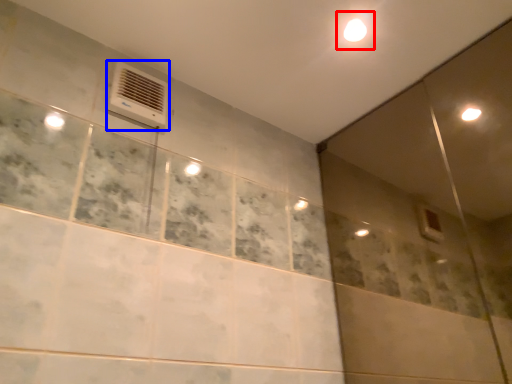
Question: Which object appears closest to the camera in this image, light (highlighted by a red box) or air conditioning (highlighted by a blue box)?

Choices:
 (A) light
 (B) air conditioning

Answer: (B)